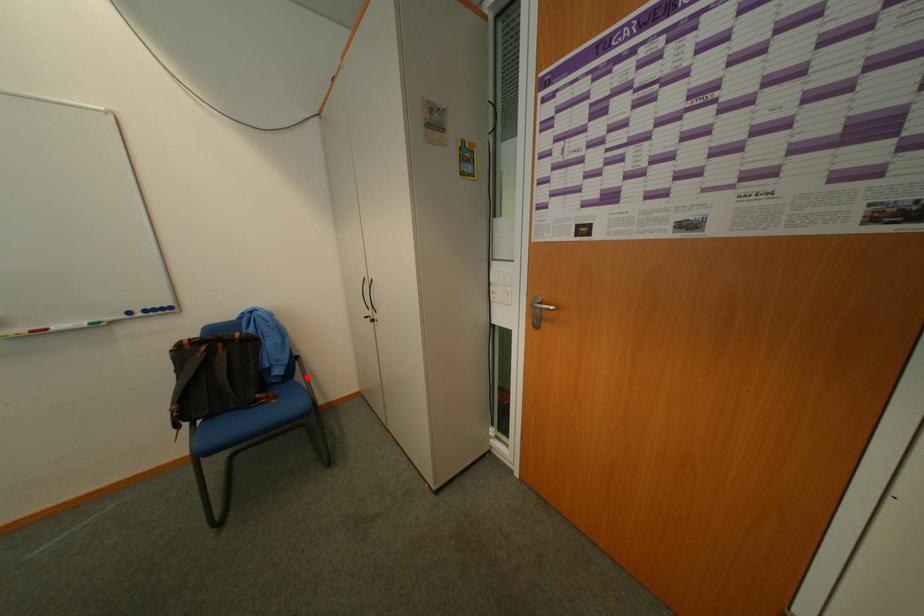
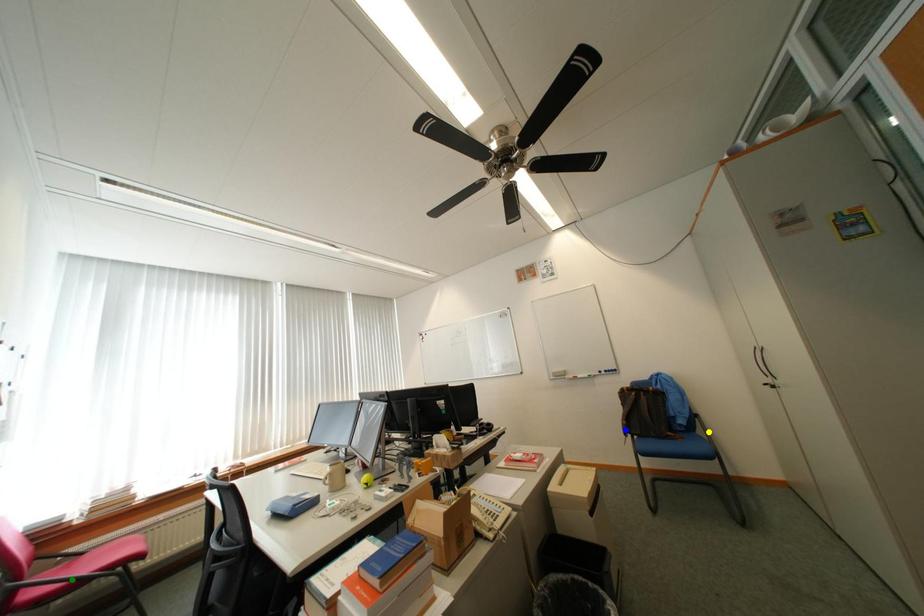
Question: I am providing you with two images of the same scene from different viewpoints. A red point is marked on the first image. You are given multiple points on the second image. Which spot in image 2 lines up with the point in image 1?

Choices:
 (A) blue point
 (B) green point
 (C) yellow point

Answer: (C)